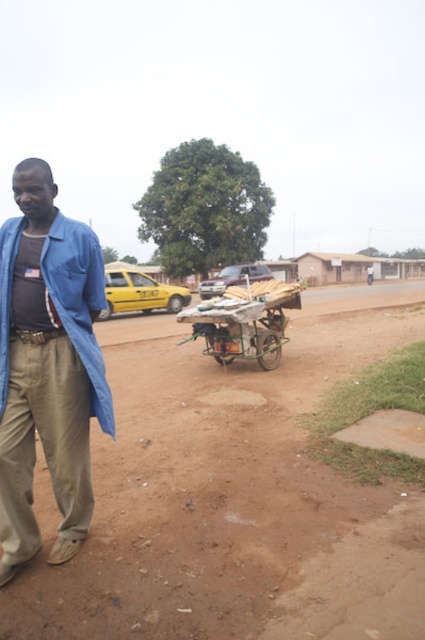
Can you confirm if blue cotton jacket at lower left is positioned below wooden cart at center?

Actually, blue cotton jacket at lower left is above wooden cart at center.

Which is more to the left, blue cotton jacket at lower left or wooden cart at center?

blue cotton jacket at lower left is more to the left.

At what (x,y) coordinates should I click in order to perform the action: click on blue cotton jacket at lower left. Please return your answer as a coordinate pair (x, y). Looking at the image, I should click on (79, 301).

Who is shorter, khaki cotton pants at lower left or wooden cart at center?

wooden cart at center is shorter.

Is khaki cotton pants at lower left to the left of wooden cart at center from the viewer's perspective?

Correct, you'll find khaki cotton pants at lower left to the left of wooden cart at center.

Who is more distant from viewer, (70, 452) or (217, 316)?

The point (217, 316) is more distant.

Where is `khaki cotton pants at lower left`? khaki cotton pants at lower left is located at coordinates click(44, 444).

Is brown dirt field at center further to the viewer compared to wooden cart at center?

No.

Between brown dirt field at center and wooden cart at center, which one has more height?

Standing taller between the two is brown dirt field at center.

Which is in front, point (342, 522) or point (224, 292)?

Point (342, 522)

The image size is (425, 640). Identify the location of brown dirt field at center. (234, 493).